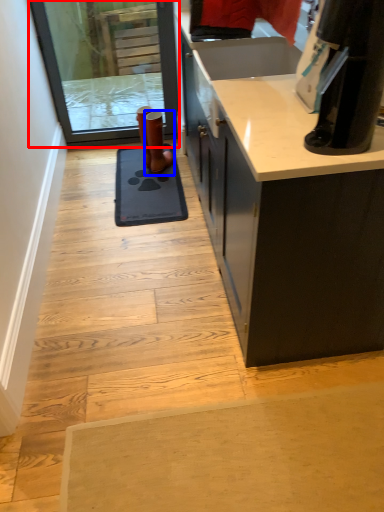
Question: Which of the following is the closest to the observer, screen door (highlighted by a red box) or footwear (highlighted by a blue box)?

Choices:
 (A) screen door
 (B) footwear

Answer: (A)